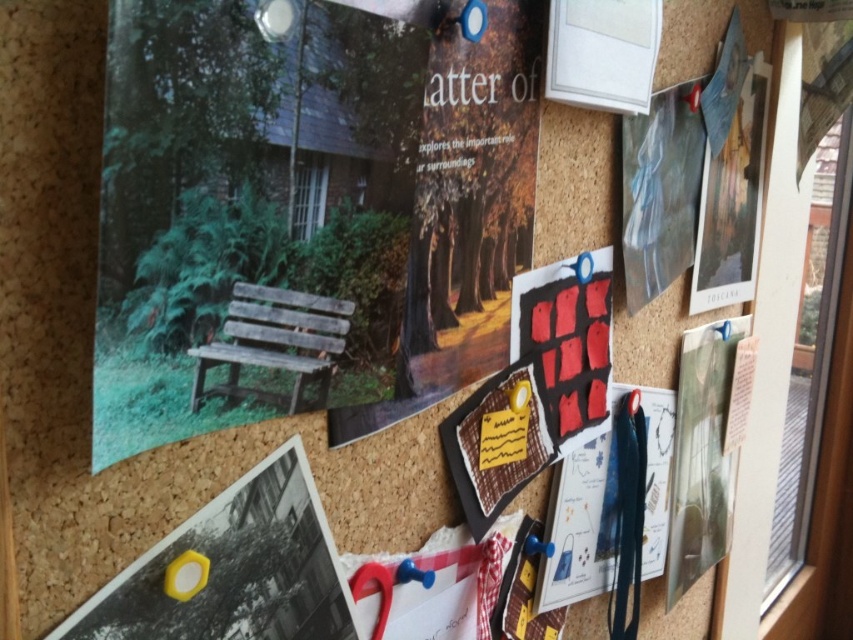
Based on the photo, is wooden bench at upper left thinner than matte red poster at center right?

Incorrect, wooden bench at upper left's width is not less than matte red poster at center right's.

Locate an element on the screen. The width and height of the screenshot is (853, 640). wooden bench at upper left is located at coordinates (308, 211).

The image size is (853, 640). Find the location of `wooden bench at upper left`. wooden bench at upper left is located at coordinates (308, 211).

Is yellow plastic hexagon at lower left shorter than matte red poster at center right?

Correct, yellow plastic hexagon at lower left is not as tall as matte red poster at center right.

Image resolution: width=853 pixels, height=640 pixels. Describe the element at coordinates (233, 570) in the screenshot. I see `yellow plastic hexagon at lower left` at that location.

Where is `yellow plastic hexagon at lower left`? This screenshot has height=640, width=853. yellow plastic hexagon at lower left is located at coordinates (233, 570).

Does wooden bench at upper left appear over yellow plastic hexagon at lower left?

Yes, wooden bench at upper left is above yellow plastic hexagon at lower left.

Which is in front, point (251, 387) or point (230, 509)?

Positioned in front is point (251, 387).

Which is in front, point (363, 332) or point (280, 490)?

Point (280, 490) is in front.

Find the location of a particular element. This screenshot has height=640, width=853. wooden bench at upper left is located at coordinates (308, 211).